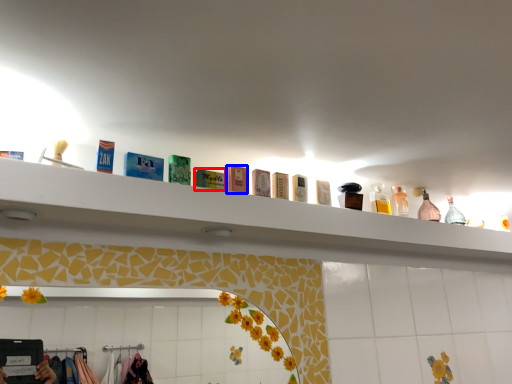
Question: Which of the following is the farthest to the observer, toiletry (highlighted by a red box) or toiletry (highlighted by a blue box)?

Choices:
 (A) toiletry
 (B) toiletry

Answer: (B)